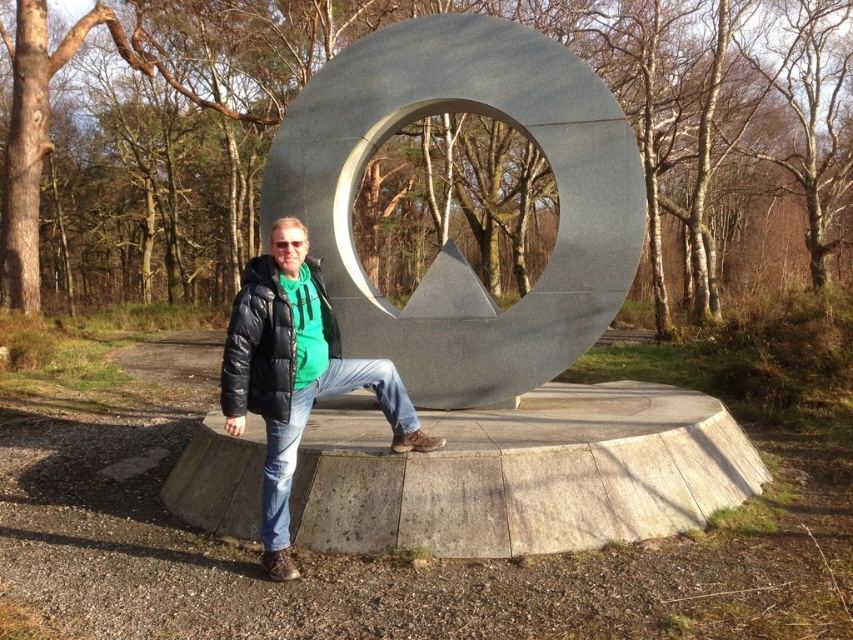
You are standing at the origin point of the coordinate system in the image. The polished metal circle at center is located at coordinates. Can you tell me its exact coordinates?

The polished metal circle at center is located at coordinates point [453,243].

You are a fashion stylist observing a person wearing two jackets. The person has a black matte jacket at center and a black puffer jacket at center. Which jacket is on the right side of the other?

The black matte jacket at center is positioned on the right side of the black puffer jacket at center.

You are trying to decide which jacket to take for a hike. You see both the black matte jacket at center and the black puffer jacket at center in the image. Which one is larger in size?

The black matte jacket at center is bigger than the black puffer jacket at center, so the black matte jacket at center is the larger one.